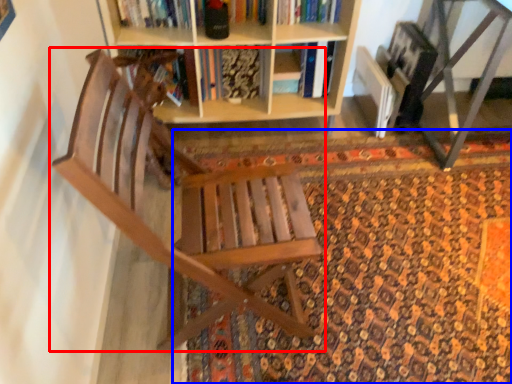
Question: Which object appears farthest to the camera in this image, chair (highlighted by a red box) or doormat (highlighted by a blue box)?

Choices:
 (A) chair
 (B) doormat

Answer: (B)